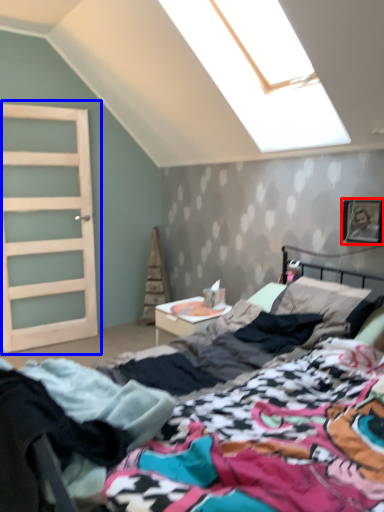
Question: Which object is further to the camera taking this photo, picture frame (highlighted by a red box) or door (highlighted by a blue box)?

Choices:
 (A) picture frame
 (B) door

Answer: (B)